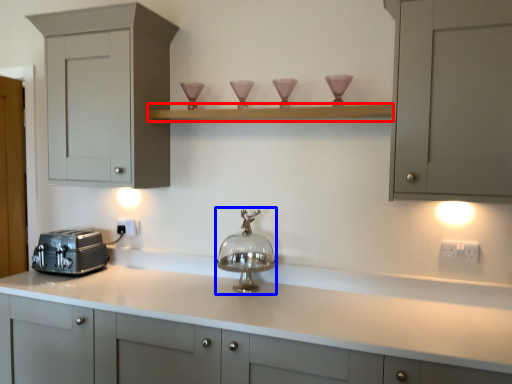
Question: Among these objects, which one is nearest to the camera, shelf (highlighted by a red box) or appliance (highlighted by a blue box)?

Choices:
 (A) shelf
 (B) appliance

Answer: (A)